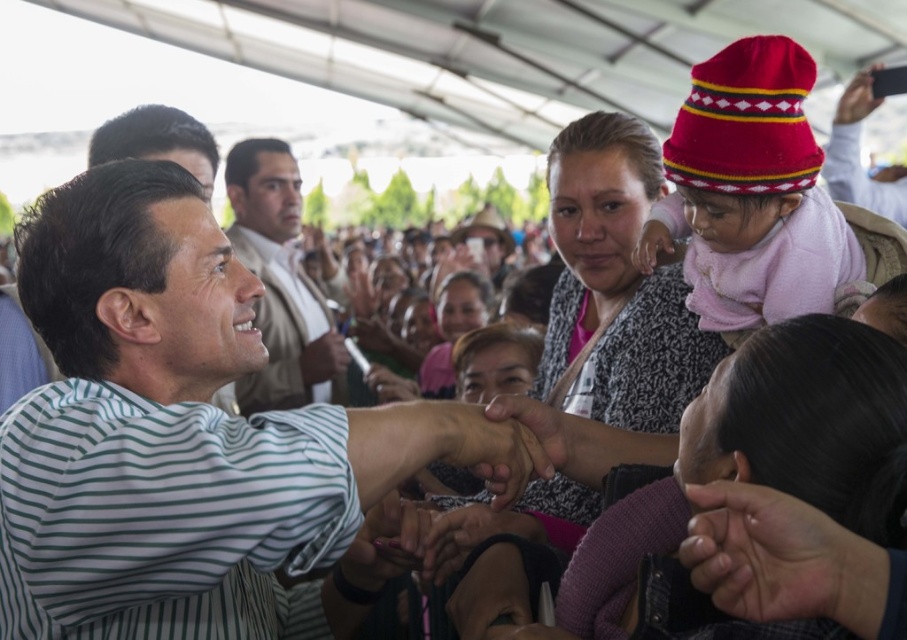
Question: Is white striped shirt at center above smooth beige shirt at center?

Choices:
 (A) no
 (B) yes

Answer: (A)

Question: Considering the real-world distances, which object is closest to the smooth beige shirt at center?

Choices:
 (A) white striped shirt at center
 (B) smooth leather wallet at upper right

Answer: (A)

Question: Which point is closer to the camera?

Choices:
 (A) (308, 372)
 (B) (836, 104)

Answer: (A)

Question: Does white striped shirt at center have a greater width compared to smooth beige shirt at center?

Choices:
 (A) yes
 (B) no

Answer: (A)

Question: Which of the following is the closest to the observer?

Choices:
 (A) click(281, 397)
 (B) click(896, 220)
 (C) click(147, 369)

Answer: (C)

Question: Is white striped shirt at center above smooth leather wallet at upper right?

Choices:
 (A) no
 (B) yes

Answer: (A)